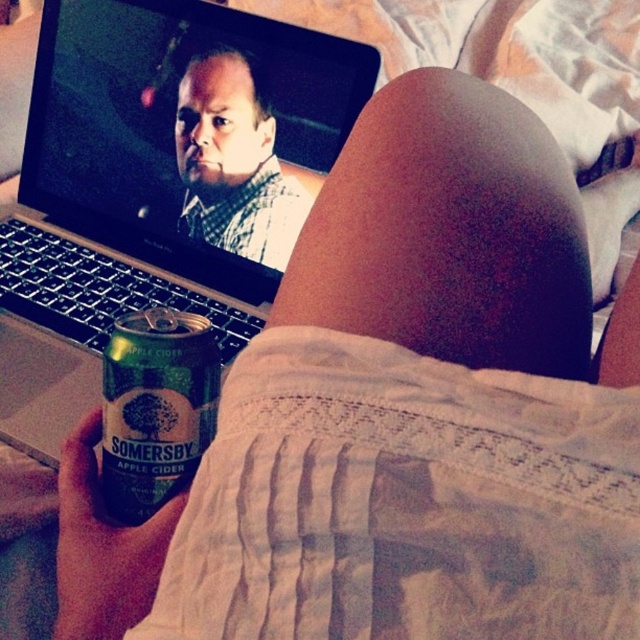
Which of these two, green matte can at lower left or matte black shirt at upper center, stands shorter?

Standing shorter between the two is green matte can at lower left.

Which is more to the left, green matte can at lower left or matte black shirt at upper center?

Positioned to the left is green matte can at lower left.

Is point (138, 346) positioned in front of point (227, 236)?

Yes, point (138, 346) is in front of point (227, 236).

Identify the location of green matte can at lower left. This screenshot has height=640, width=640. (156, 408).

Can you confirm if silver metallic laptop at upper left is smaller than green matte can at lower left?

Actually, silver metallic laptop at upper left might be larger than green matte can at lower left.

Does silver metallic laptop at upper left have a lesser height compared to green matte can at lower left?

No.

Who is more distant from viewer, (176, 109) or (124, 436)?

Point (176, 109)

At what (x,y) coordinates should I click in order to perform the action: click on silver metallic laptop at upper left. Please return your answer as a coordinate pair (x, y). Looking at the image, I should click on (154, 188).

Is silver metallic laptop at upper left smaller than matte black shirt at upper center?

Actually, silver metallic laptop at upper left might be larger than matte black shirt at upper center.

Between point (154, 186) and point (257, 93), which one is positioned behind?

Positioned behind is point (154, 186).

This screenshot has width=640, height=640. In order to click on silver metallic laptop at upper left in this screenshot , I will do `click(154, 188)`.